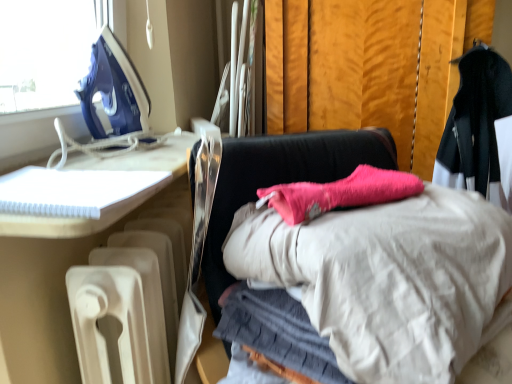
Question: Does white plastic radiator at lower left, the 2th furniture from the left, come behind pink fabric at center, the first furniture positioned from the right?

Choices:
 (A) no
 (B) yes

Answer: (B)

Question: Can you confirm if white plastic radiator at lower left, the 2th furniture from the left, is smaller than pink fabric at center, which is the 3th furniture from left to right?

Choices:
 (A) yes
 (B) no

Answer: (B)

Question: Can you confirm if white plastic radiator at lower left, which ranks as the second furniture in right-to-left order, is thinner than pink fabric at center, the first furniture positioned from the right?

Choices:
 (A) no
 (B) yes

Answer: (B)

Question: Is white plastic radiator at lower left, the 2th furniture from the left, completely or partially outside of pink fabric at center, which is the 3th furniture from left to right?

Choices:
 (A) no
 (B) yes

Answer: (B)

Question: Is white plastic radiator at lower left, which ranks as the second furniture in right-to-left order, closer to the viewer compared to pink fabric at center, which is the 3th furniture from left to right?

Choices:
 (A) no
 (B) yes

Answer: (A)

Question: Is white plastic notebook at left, which is counted as the 1th furniture, starting from the left, taller or shorter than pink fabric at center, which is the 3th furniture from left to right?

Choices:
 (A) tall
 (B) short

Answer: (B)

Question: Visually, is white plastic notebook at left, which ranks as the 3th furniture in right-to-left order, positioned to the left or to the right of pink fabric at center, which is the 3th furniture from left to right?

Choices:
 (A) right
 (B) left

Answer: (B)

Question: From a real-world perspective, relative to pink fabric at center, the first furniture positioned from the right, is white plastic notebook at left, which is counted as the 1th furniture, starting from the left, vertically above or below?

Choices:
 (A) above
 (B) below

Answer: (A)

Question: Considering their positions, is white plastic notebook at left, which is counted as the 1th furniture, starting from the left, located in front of or behind pink fabric at center, which is the 3th furniture from left to right?

Choices:
 (A) front
 (B) behind

Answer: (B)

Question: Considering the relative positions of blue plastic iron at upper left and white plastic notebook at left, which is counted as the 1th furniture, starting from the left, in the image provided, is blue plastic iron at upper left to the left or to the right of white plastic notebook at left, which is counted as the 1th furniture, starting from the left,?

Choices:
 (A) right
 (B) left

Answer: (B)

Question: From the image's perspective, is blue plastic iron at upper left above or below white plastic notebook at left, which ranks as the 3th furniture in right-to-left order?

Choices:
 (A) above
 (B) below

Answer: (A)

Question: Does point (131, 104) appear closer or farther from the camera than point (66, 228)?

Choices:
 (A) closer
 (B) farther

Answer: (B)

Question: Is blue plastic iron at upper left inside or outside of white plastic notebook at left, which ranks as the 3th furniture in right-to-left order?

Choices:
 (A) outside
 (B) inside

Answer: (A)

Question: Is white plastic notebook at left, which is counted as the 1th furniture, starting from the left, taller or shorter than black woolen coat at upper right?

Choices:
 (A) tall
 (B) short

Answer: (B)

Question: Does point (57, 231) appear closer or farther from the camera than point (500, 114)?

Choices:
 (A) farther
 (B) closer

Answer: (B)